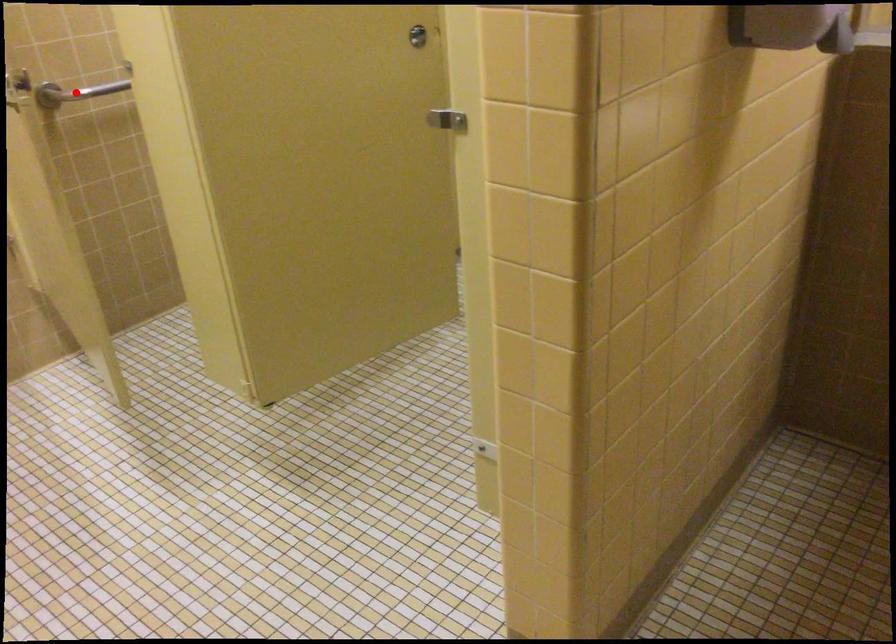
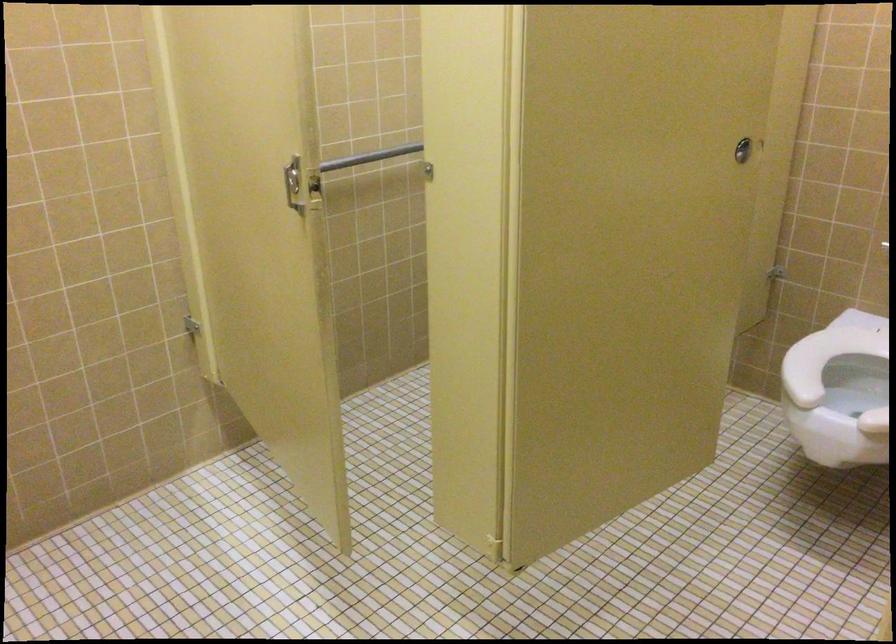
Question: I am providing you with two images of the same scene from different viewpoints. A red point is marked on the first image. Can you still see the location of the red point in image 2?

Choices:
 (A) Yes
 (B) No

Answer: (B)